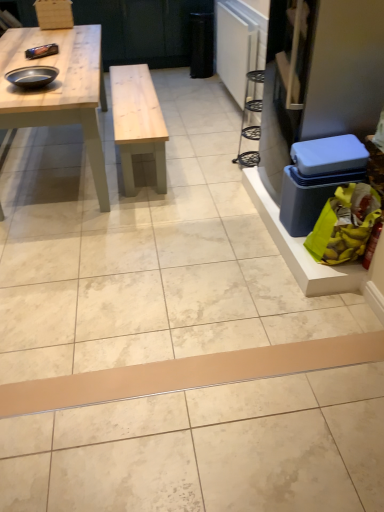
Where is `light wood table at upper left`? This screenshot has height=512, width=384. light wood table at upper left is located at coordinates (59, 89).

The image size is (384, 512). Describe the element at coordinates (318, 178) in the screenshot. I see `blue plastic box at right` at that location.

You are a GUI agent. You are given a task and a screenshot of the screen. Output one action in this format:
    pyautogui.click(x=<x>, y=<y>)
    Task: Click on the black matte bowl at upper left
    
    Given the screenshot: What is the action you would take?
    pyautogui.click(x=32, y=76)

Considering the sizes of objects beige matte plank at center and yellow plastic bag at lower right in the image provided, who is smaller, beige matte plank at center or yellow plastic bag at lower right?

yellow plastic bag at lower right.

Is beige matte plank at center oriented away from yellow plastic bag at lower right?

No, beige matte plank at center is not facing the opposite direction of yellow plastic bag at lower right.

From a real-world perspective, between beige matte plank at center and yellow plastic bag at lower right, who is vertically higher?

yellow plastic bag at lower right, from a real-world perspective.

Is beige matte plank at center touching yellow plastic bag at lower right?

beige matte plank at center and yellow plastic bag at lower right are not in contact.

Is light wood table at upper left facing towards blue plastic box at right?

No, light wood table at upper left is not facing towards blue plastic box at right.

Considering the relative sizes of light wood table at upper left and blue plastic box at right in the image provided, is light wood table at upper left wider than blue plastic box at right?

Yes, light wood table at upper left is wider than blue plastic box at right.

This screenshot has height=512, width=384. What are the coordinates of `box that is in front of the light wood table at upper left` in the screenshot? It's located at (318, 178).

Identify the location of tray on the left of blue plastic box at right. This screenshot has height=512, width=384. (32, 76).

Between blue plastic box at right and black matte bowl at upper left, which one has less height?

black matte bowl at upper left is shorter.

Is blue plastic box at right in front of or behind black matte bowl at upper left in the image?

blue plastic box at right is positioned closer to the viewer than black matte bowl at upper left.

From the image's perspective, relative to black matte bowl at upper left, is blue plastic box at right above or below?

blue plastic box at right is below black matte bowl at upper left.

How many degrees apart are the facing directions of yellow plastic bag at lower right and black matte bowl at upper left?

The angle between the facing direction of yellow plastic bag at lower right and the facing direction of black matte bowl at upper left is 89.2 degrees.

Looking at this image, could you tell me if yellow plastic bag at lower right is turned towards black matte bowl at upper left?

No, yellow plastic bag at lower right is not facing towards black matte bowl at upper left.

Is yellow plastic bag at lower right completely or partially outside of black matte bowl at upper left?

Yes, yellow plastic bag at lower right is located beyond the bounds of black matte bowl at upper left.

From a real-world perspective, between yellow plastic bag at lower right and black matte bowl at upper left, who is vertically lower?

In real-world perspective, yellow plastic bag at lower right is lower.

Is blue plastic box at right to the left or to the right of yellow plastic bag at lower right in the image?

Based on their positions, blue plastic box at right is located to the left of yellow plastic bag at lower right.

In the scene shown: From the image's perspective, does blue plastic box at right appear higher than yellow plastic bag at lower right?

Yes.

Locate an element on the screen. food located below the blue plastic box at right (from the image's perspective) is located at coordinates (344, 224).

Is blue plastic box at right inside the boundaries of yellow plastic bag at lower right, or outside?

blue plastic box at right is outside yellow plastic bag at lower right.

Is beige matte plank at center bigger than black matte bowl at upper left?

Indeed, beige matte plank at center has a larger size compared to black matte bowl at upper left.

Is black matte bowl at upper left at the back of beige matte plank at center?

beige matte plank at center does not have its back to black matte bowl at upper left.

Is beige matte plank at center taller or shorter than black matte bowl at upper left?

In the image, beige matte plank at center appears to be taller than black matte bowl at upper left.

Is beige matte plank at center spatially inside black matte bowl at upper left, or outside of it?

beige matte plank at center is located beyond the bounds of black matte bowl at upper left.

Locate an element on the screen. The width and height of the screenshot is (384, 512). food that appears below the blue plastic box at right (from a real-world perspective) is located at coordinates (344, 224).

Is yellow plastic bag at lower right to the left or to the right of blue plastic box at right in the image?

From the image, it's evident that yellow plastic bag at lower right is to the right of blue plastic box at right.

From the image's perspective, is yellow plastic bag at lower right under blue plastic box at right?

Yes.

Considering the relative sizes of yellow plastic bag at lower right and blue plastic box at right in the image provided, is yellow plastic bag at lower right taller than blue plastic box at right?

No.

The image size is (384, 512). In order to click on food lying above the beige matte plank at center (from the image's perspective) in this screenshot , I will do `click(344, 224)`.

Where is `table that is above the blue plastic box at right (from a real-world perspective)`? table that is above the blue plastic box at right (from a real-world perspective) is located at coordinates (59, 89).

When comparing their distances from beige matte plank at center, does black matte bowl at upper left or yellow plastic bag at lower right seem closer?

yellow plastic bag at lower right.

Estimate the real-world distances between objects in this image. Which object is further from yellow plastic bag at lower right, black matte bowl at upper left or light wood table at upper left?

black matte bowl at upper left lies further to yellow plastic bag at lower right than the other object.

From the picture: Considering their positions, is yellow plastic bag at lower right positioned closer to light wood table at upper left than black matte bowl at upper left?

black matte bowl at upper left is closer to light wood table at upper left.

From the image, which object appears to be nearer to blue plastic box at right, yellow plastic bag at lower right or black matte bowl at upper left?

The object closer to blue plastic box at right is yellow plastic bag at lower right.

Based on their spatial positions, is light wood table at upper left or yellow plastic bag at lower right closer to blue plastic box at right?

yellow plastic bag at lower right is closer to blue plastic box at right.

Which object lies further to the anchor point beige matte plank at center, black matte bowl at upper left or blue plastic box at right?

The object further to beige matte plank at center is black matte bowl at upper left.

Considering their positions, is yellow plastic bag at lower right positioned closer to black matte bowl at upper left than beige matte plank at center?

Among the two, yellow plastic bag at lower right is located nearer to black matte bowl at upper left.

Estimate the real-world distances between objects in this image. Which object is closer to beige matte plank at center, blue plastic box at right or yellow plastic bag at lower right?

yellow plastic bag at lower right lies closer to beige matte plank at center than the other object.

The width and height of the screenshot is (384, 512). I want to click on plank situated between light wood table at upper left and blue plastic box at right from left to right, so [x=188, y=373].

I want to click on plank between light wood table at upper left and yellow plastic bag at lower right, so click(188, 373).

Find the location of `tray situated between light wood table at upper left and yellow plastic bag at lower right from left to right`. tray situated between light wood table at upper left and yellow plastic bag at lower right from left to right is located at coordinates (32, 76).

Locate an element on the screen. plank located between black matte bowl at upper left and yellow plastic bag at lower right in the left-right direction is located at coordinates (188, 373).